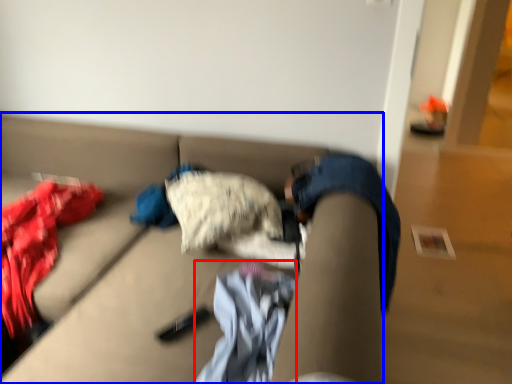
Question: Which object appears closest to the camera in this image, baby clothe (highlighted by a red box) or studio couch (highlighted by a blue box)?

Choices:
 (A) baby clothe
 (B) studio couch

Answer: (B)